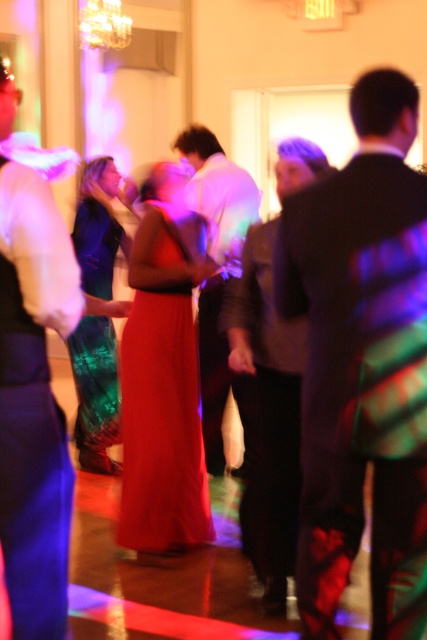
Does matte red dress at center have a smaller size compared to shiny green dress at center?

Yes, matte red dress at center is smaller than shiny green dress at center.

Does matte red dress at center have a larger size compared to shiny green dress at center?

No.

Measure the distance between point (169,465) and camera.

Point (169,465) and camera are 3.54 meters apart.

The height and width of the screenshot is (640, 427). Identify the location of matte red dress at center. (161, 426).

Is shiny black suit at center wider than white shirt at center?

No, shiny black suit at center is not wider than white shirt at center.

Identify the location of shiny black suit at center. This screenshot has height=640, width=427. (362, 364).

At what (x,y) coordinates should I click in order to perform the action: click on shiny black suit at center. Please return your answer as a coordinate pair (x, y). Looking at the image, I should click on (362, 364).

Is dark gray sweater at center in front of white shirt at center?

Yes, it is in front of white shirt at center.

Where is `dark gray sweater at center`? The height and width of the screenshot is (640, 427). dark gray sweater at center is located at coordinates (268, 413).